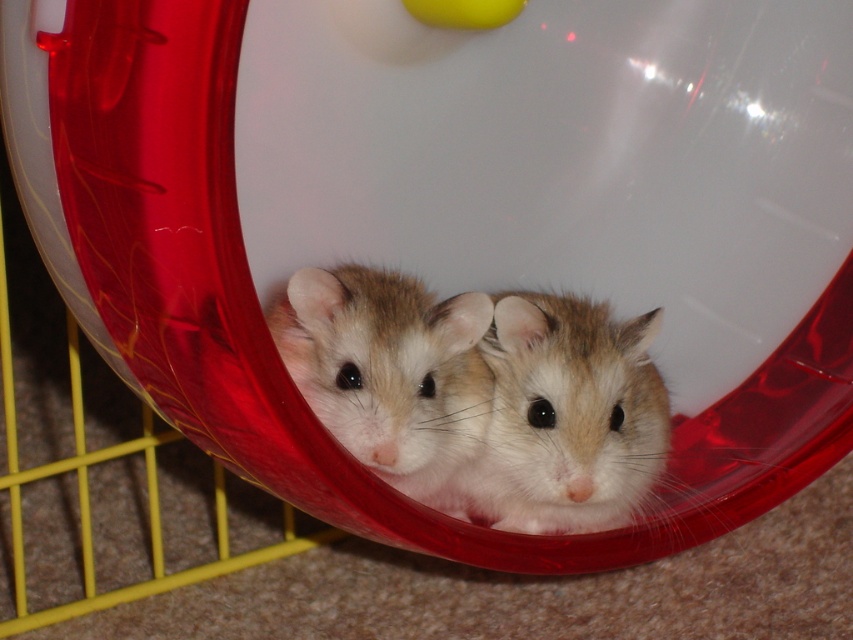
Question: Can you confirm if fuzzy beige mouse at center is positioned to the left of fuzzy beige hamster at center?

Choices:
 (A) yes
 (B) no

Answer: (B)

Question: Does fuzzy beige mouse at center appear on the left side of fuzzy beige hamster at center?

Choices:
 (A) no
 (B) yes

Answer: (A)

Question: Does fuzzy beige mouse at center have a lesser width compared to fuzzy beige hamster at center?

Choices:
 (A) yes
 (B) no

Answer: (A)

Question: Which of the following is the closest to the observer?

Choices:
 (A) (350, 330)
 (B) (636, 374)

Answer: (A)

Question: Which object appears closest to the camera in this image?

Choices:
 (A) fuzzy beige mouse at center
 (B) fuzzy beige hamster at center

Answer: (B)